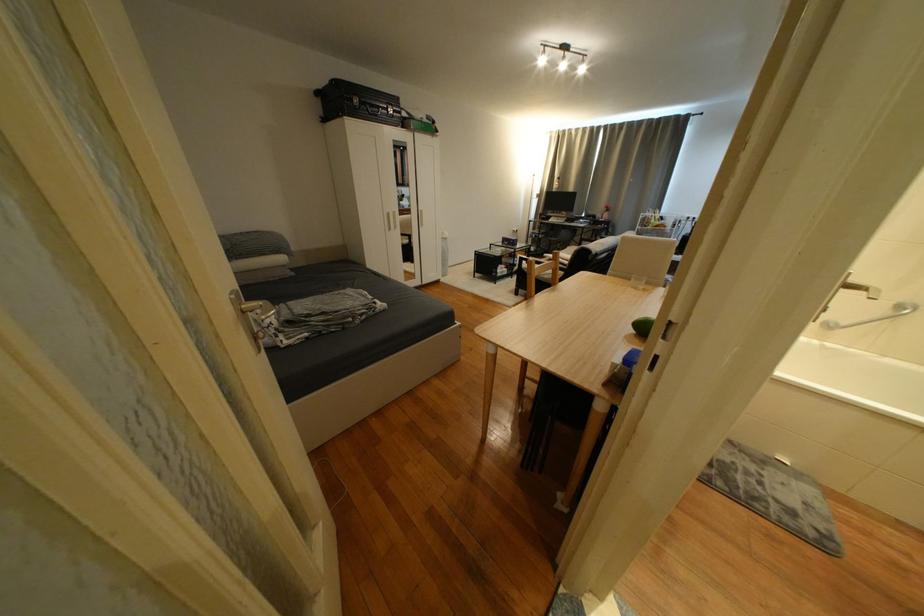
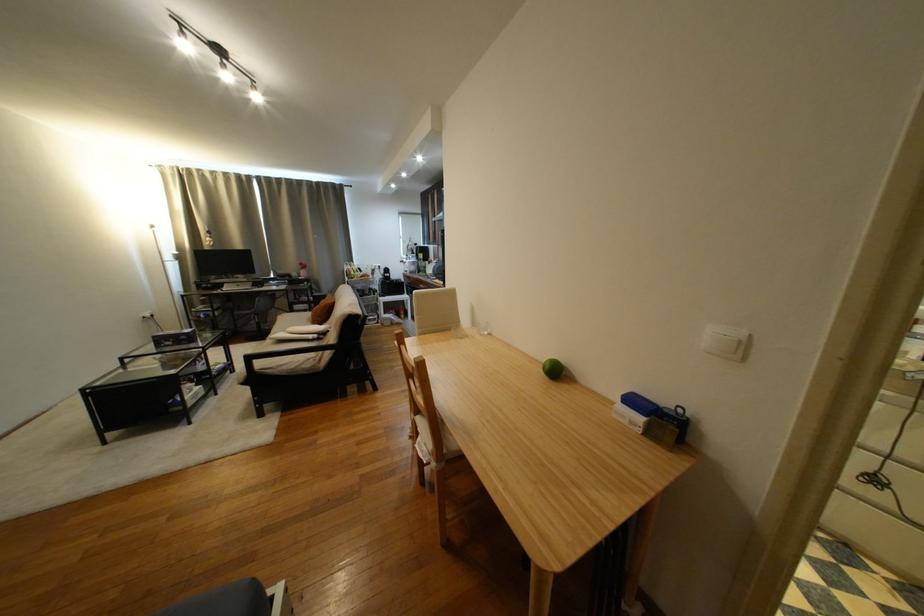
The point at (467, 325) is marked in the first image. Where is the corresponding point in the second image?

(286, 592)